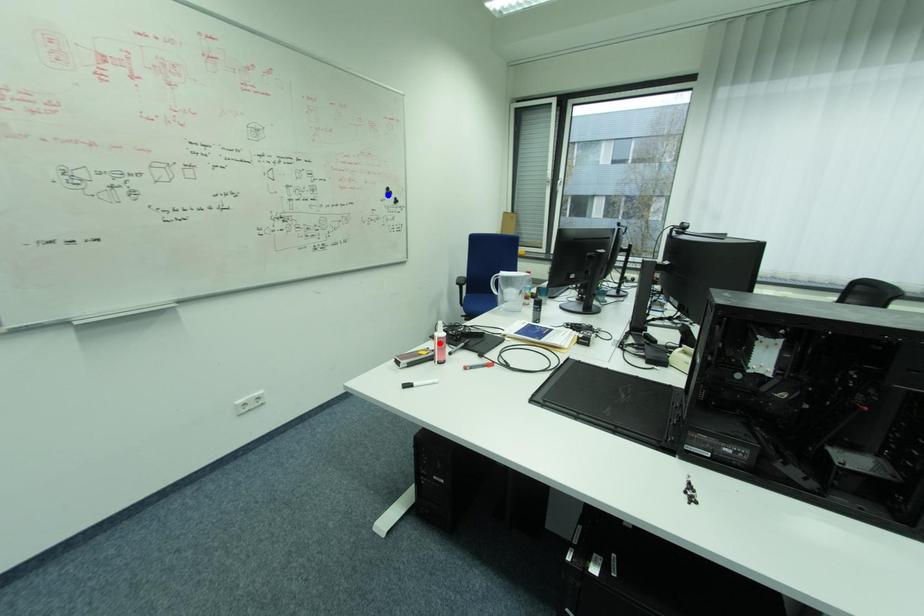
Question: Two points are marked on the image. Which point is closer to the camera?

Choices:
 (A) Blue point is closer.
 (B) Red point is closer.

Answer: (B)